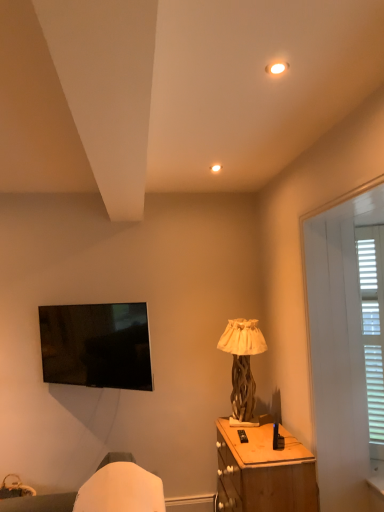
Locate an element on the screen. matte white light fixture at upper center is located at coordinates (216, 168).

What are the coordinates of `white wooden blinds at right` in the screenshot? It's located at (373, 322).

Locate an element on the screen. wooden textured lamp at center is located at coordinates click(x=242, y=362).

From the image's perspective, is white wooden blinds at right positioned above or below matte white light fixture at upper center?

Clearly, from the image's perspective, white wooden blinds at right is below matte white light fixture at upper center.

Locate an element on the screen. The height and width of the screenshot is (512, 384). bay window below the matte white light fixture at upper center (from the image's perspective) is located at coordinates click(373, 322).

Does white wooden blinds at right lie in front of matte white light fixture at upper center?

Yes, white wooden blinds at right is closer to the viewer.

Is white wooden blinds at right not near matte white light fixture at upper center?

Indeed, white wooden blinds at right is not near matte white light fixture at upper center.

Is wooden textured lamp at center facing towards white wood screen door at right?

No, wooden textured lamp at center does not turn towards white wood screen door at right.

Is white wood screen door at right inside wooden textured lamp at center?

That's incorrect, white wood screen door at right is not inside wooden textured lamp at center.

From the image's perspective, which one is positioned lower, wooden textured lamp at center or white wood screen door at right?

wooden textured lamp at center, from the image's perspective.

Who is taller, wooden textured lamp at center or white wood screen door at right?

white wood screen door at right.

Is wooden nightstand at lower right thinner than wooden textured lamp at center?

Incorrect, the width of wooden nightstand at lower right is not less than that of wooden textured lamp at center.

Which of these two, wooden nightstand at lower right or wooden textured lamp at center, stands taller?

wooden textured lamp at center.

Based on the photo, how different are the orientations of wooden nightstand at lower right and wooden textured lamp at center in degrees?

The angle between the facing direction of wooden nightstand at lower right and the facing direction of wooden textured lamp at center is 2.93 degrees.

From the picture: Which of these two, wooden nightstand at lower right or white wooden blinds at right, is wider?

wooden nightstand at lower right is wider.

Consider the image. Is wooden nightstand at lower right touching white wooden blinds at right?

They are not placed beside each other.

Does point (282, 436) appear closer or farther from the camera than point (362, 325)?

Point (282, 436) is farther from the camera than point (362, 325).

Would you say white wooden blinds at right is part of wooden nightstand at lower right's contents?

No, white wooden blinds at right is not surrounded by wooden nightstand at lower right.

Can you confirm if matte white light fixture at upper center is taller than white wood screen door at right?

No, matte white light fixture at upper center is not taller than white wood screen door at right.

Considering the sizes of objects matte white light fixture at upper center and white wood screen door at right in the image provided, who is bigger, matte white light fixture at upper center or white wood screen door at right?

With larger size is white wood screen door at right.

In the scene shown: Is matte white light fixture at upper center closer to camera compared to white wood screen door at right?

No, matte white light fixture at upper center is further to the viewer.

Considering the points (212, 170) and (362, 209), which point is in front, point (212, 170) or point (362, 209)?

Positioned in front is point (362, 209).

Is white wooden blinds at right oriented towards wooden textured lamp at center?

No.

Which of these two, white wooden blinds at right or wooden textured lamp at center, is smaller?

white wooden blinds at right.

From a real-world perspective, between white wooden blinds at right and wooden textured lamp at center, who is vertically higher?

From a 3D spatial view, white wooden blinds at right is above.

How different are the orientations of white wooden blinds at right and wooden textured lamp at center in degrees?

56.8 degrees separate the facing orientations of white wooden blinds at right and wooden textured lamp at center.

Is white wood screen door at right situated inside matte white light fixture at upper center or outside?

white wood screen door at right is spatially situated outside matte white light fixture at upper center.

From the image's perspective, which object appears higher, white wood screen door at right or matte white light fixture at upper center?

matte white light fixture at upper center, from the image's perspective.

Is white wood screen door at right oriented towards matte white light fixture at upper center?

No, white wood screen door at right is not turned towards matte white light fixture at upper center.

Considering the relative sizes of white wood screen door at right and matte white light fixture at upper center in the image provided, is white wood screen door at right shorter than matte white light fixture at upper center?

No, white wood screen door at right is not shorter than matte white light fixture at upper center.

This screenshot has width=384, height=512. Find the location of `bay window below the matte white light fixture at upper center (from a real-world perspective)`. bay window below the matte white light fixture at upper center (from a real-world perspective) is located at coordinates (373, 322).

The image size is (384, 512). I want to click on screen door that is above the wooden textured lamp at center (from a real-world perspective), so click(347, 345).

From the image, which object appears to be nearer to wooden nightstand at lower right, wooden textured lamp at center or white wood screen door at right?

wooden textured lamp at center lies closer to wooden nightstand at lower right than the other object.

From the image, which object appears to be nearer to white wooden blinds at right, wooden nightstand at lower right or white wood screen door at right?

white wood screen door at right is positioned closer to the anchor white wooden blinds at right.

Looking at the image, which one is located further to white wood screen door at right, white wooden blinds at right or matte white light fixture at upper center?

Based on the image, matte white light fixture at upper center appears to be further to white wood screen door at right.

Considering their positions, is wooden nightstand at lower right positioned closer to wooden textured lamp at center than white wooden blinds at right?

Based on the image, wooden nightstand at lower right appears to be nearer to wooden textured lamp at center.

Considering their positions, is matte white light fixture at upper center positioned further to wooden textured lamp at center than wooden nightstand at lower right?

matte white light fixture at upper center lies further to wooden textured lamp at center than the other object.

Which object lies nearer to the anchor point wooden nightstand at lower right, white wood screen door at right or white wooden blinds at right?

Among the two, white wood screen door at right is located nearer to wooden nightstand at lower right.

Looking at the image, which one is located further to white wood screen door at right, matte white light fixture at upper center or wooden textured lamp at center?

matte white light fixture at upper center is positioned further to the anchor white wood screen door at right.

Which object lies nearer to the anchor point wooden nightstand at lower right, matte white light fixture at upper center or wooden textured lamp at center?

wooden textured lamp at center is closer to wooden nightstand at lower right.

Locate an element on the screen. This screenshot has width=384, height=512. nightstand between white wood screen door at right and wooden textured lamp at center in the front-back direction is located at coordinates (264, 471).

The height and width of the screenshot is (512, 384). I want to click on screen door between matte white light fixture at upper center and wooden textured lamp at center in the up-down direction, so click(x=347, y=345).

Where is `bay window positioned between white wood screen door at right and wooden textured lamp at center from near to far`? bay window positioned between white wood screen door at right and wooden textured lamp at center from near to far is located at coordinates (373, 322).

In order to click on screen door between matte white light fixture at upper center and wooden nightstand at lower right in the up-down direction in this screenshot , I will do `click(347, 345)`.